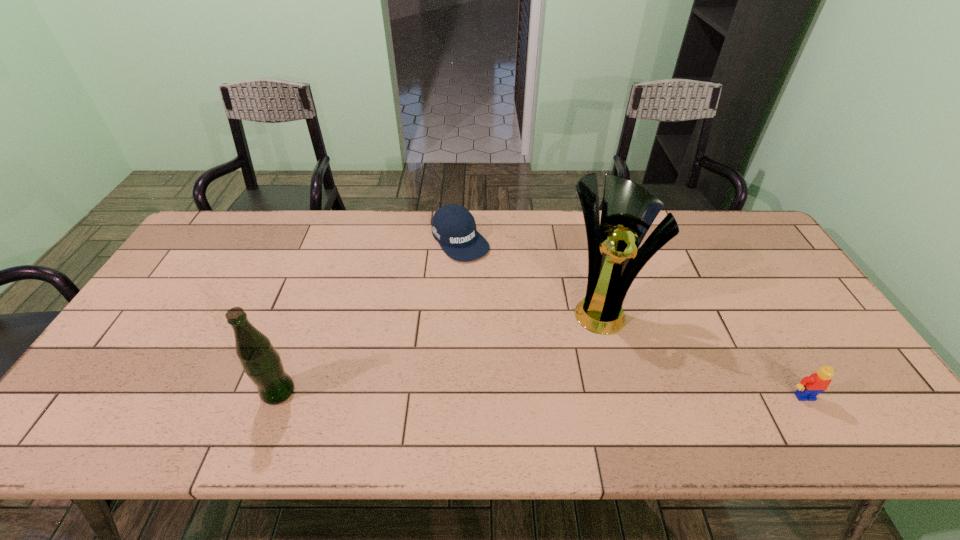
The width and height of the screenshot is (960, 540). Identify the location of vacant space situated at the front of the tallest object, where the globe is visible. (586, 377).

This screenshot has height=540, width=960. Identify the location of free point located 0.290m on the front-facing side of the second object from left to right. (527, 321).

Find the location of `free space located on the front-facing side of the second object from left to right`. free space located on the front-facing side of the second object from left to right is located at coordinates (494, 284).

Where is `free space located 0.290m on the front-facing side of the second object from left to right`? The width and height of the screenshot is (960, 540). free space located 0.290m on the front-facing side of the second object from left to right is located at coordinates (527, 321).

You are a GUI agent. You are given a task and a screenshot of the screen. Output one action in this format:
    pyautogui.click(x=<x>, y=<y>)
    Task: Click on the object that is at the far edge
    The image size is (960, 540).
    Given the screenshot: What is the action you would take?
    pyautogui.click(x=453, y=226)

Locate an element on the screen. This screenshot has height=540, width=960. beer bottle at the near edge is located at coordinates (261, 362).

The width and height of the screenshot is (960, 540). I want to click on Lego at the near edge, so click(x=811, y=386).

You are a GUI agent. You are given a task and a screenshot of the screen. Output one action in this format:
    pyautogui.click(x=<x>, y=<y>)
    Task: Click on the object at the right edge
    The height and width of the screenshot is (540, 960).
    Given the screenshot: What is the action you would take?
    pyautogui.click(x=811, y=386)

Locate an element on the screen. The image size is (960, 540). object present at the near right corner is located at coordinates (811, 386).

You are a GUI agent. You are given a task and a screenshot of the screen. Output one action in this format:
    pyautogui.click(x=<x>, y=<y>)
    Task: Click on the free space at the far edge
    The height and width of the screenshot is (540, 960).
    Given the screenshot: What is the action you would take?
    pyautogui.click(x=511, y=250)